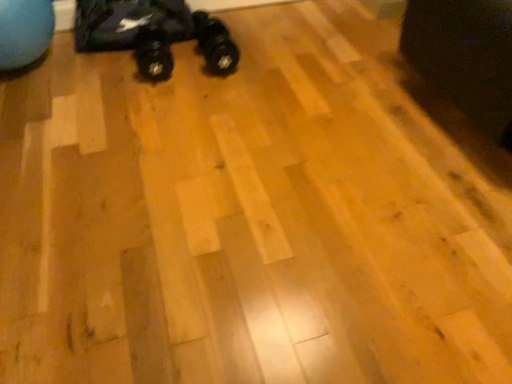
Describe the element at coordinates (153, 34) in the screenshot. The image size is (512, 384). I see `black rubber toy car at upper left` at that location.

In order to face black rubber shoe at center, should I rotate leftwards or rightwards?

Turn left by 5.614 degrees to look at black rubber shoe at center.

Locate an element on the screen. Image resolution: width=512 pixels, height=384 pixels. black rubber toy car at upper left is located at coordinates (153, 34).

Are black rubber shoe at center and black fabric swivel chair at upper right making contact?

No, black rubber shoe at center is not next to black fabric swivel chair at upper right.

Consider the image. Which point is more forward, (219, 69) or (492, 74)?

Positioned in front is point (492, 74).

Is black fabric swivel chair at upper right at the back of black rubber shoe at center?

No, black rubber shoe at center's orientation is not away from black fabric swivel chair at upper right.

From the image's perspective, is black rubber toy car at upper left above black fabric swivel chair at upper right?

Yes, from the image's perspective, black rubber toy car at upper left is over black fabric swivel chair at upper right.

Is the surface of black rubber toy car at upper left in direct contact with black fabric swivel chair at upper right?

A: No, black rubber toy car at upper left is not next to black fabric swivel chair at upper right.

Choose the correct answer: Is black rubber toy car at upper left inside black fabric swivel chair at upper right or outside it?

black rubber toy car at upper left exists outside the volume of black fabric swivel chair at upper right.

From the image's perspective, between black rubber toy car at upper left and black rubber shoe at center, which one is located above?

From the image's view, black rubber toy car at upper left is above.

From a real-world perspective, who is located lower, black rubber toy car at upper left or black rubber shoe at center?

black rubber shoe at center, from a real-world perspective.

Find the location of a particular element. footwear that appears below the black rubber toy car at upper left (from the image's perspective) is located at coordinates (215, 45).

Image resolution: width=512 pixels, height=384 pixels. In order to click on footwear located above the black fabric swivel chair at upper right (from the image's perspective) in this screenshot , I will do `click(215, 45)`.

Relative to black rubber shoe at center, is black fabric swivel chair at upper right in front or behind?

black fabric swivel chair at upper right is in front of black rubber shoe at center.

Does point (484, 73) come closer to viewer compared to point (207, 20)?

Yes.

Based on the photo, from a real-world perspective, is black fabric swivel chair at upper right located higher than black rubber toy car at upper left?

Yes.

Based on their positions, is black fabric swivel chair at upper right located to the left or right of black rubber toy car at upper left?

Based on their positions, black fabric swivel chair at upper right is located to the right of black rubber toy car at upper left.

From the image's perspective, which one is positioned lower, black fabric swivel chair at upper right or black rubber toy car at upper left?

From the image's view, black fabric swivel chair at upper right is below.

Is black rubber shoe at center positioned beyond the bounds of black rubber toy car at upper left?

Indeed, black rubber shoe at center is completely outside black rubber toy car at upper left.

Can you see black rubber shoe at center touching black rubber toy car at upper left?

black rubber shoe at center and black rubber toy car at upper left are not in contact.

Can you confirm if black rubber shoe at center is smaller than black rubber toy car at upper left?

Yes, black rubber shoe at center is smaller than black rubber toy car at upper left.

From the picture: Can you tell me how much black rubber shoe at center and black rubber toy car at upper left differ in facing direction?

The facing directions of black rubber shoe at center and black rubber toy car at upper left are 0.000229 degrees apart.

In order to click on swivel chair below the black rubber shoe at center (from the image's perspective) in this screenshot , I will do `click(465, 57)`.

In order to click on toy car that appears behind the black fabric swivel chair at upper right in this screenshot , I will do `click(153, 34)`.

Looking at the image, which one is located further to black rubber shoe at center, black rubber toy car at upper left or black fabric swivel chair at upper right?

black fabric swivel chair at upper right.

Estimate the real-world distances between objects in this image. Which object is closer to black rubber shoe at center, black fabric swivel chair at upper right or black rubber toy car at upper left?

black rubber toy car at upper left is positioned closer to the anchor black rubber shoe at center.

Which object lies further to the anchor point black fabric swivel chair at upper right, black rubber shoe at center or black rubber toy car at upper left?

black rubber toy car at upper left.

Looking at the image, which one is located closer to black fabric swivel chair at upper right, black rubber toy car at upper left or black rubber shoe at center?

black rubber shoe at center is closer to black fabric swivel chair at upper right.

Looking at the image, which one is located further to black rubber toy car at upper left, black rubber shoe at center or black fabric swivel chair at upper right?

black fabric swivel chair at upper right lies further to black rubber toy car at upper left than the other object.

Based on their spatial positions, is black fabric swivel chair at upper right or black rubber shoe at center closer to black rubber toy car at upper left?

Based on the image, black rubber shoe at center appears to be nearer to black rubber toy car at upper left.

This screenshot has height=384, width=512. I want to click on footwear situated between black rubber toy car at upper left and black fabric swivel chair at upper right from left to right, so click(215, 45).